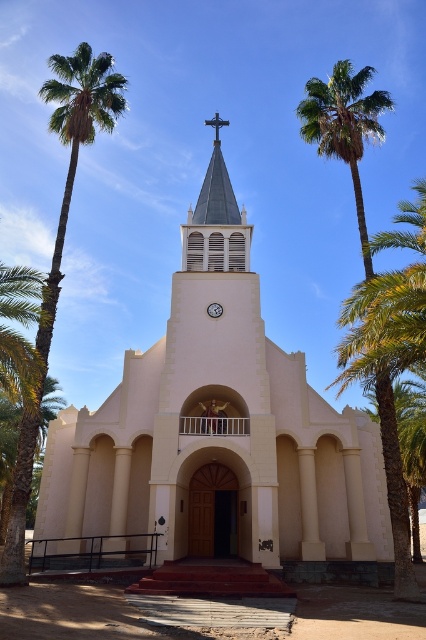
You are standing in front of the church and want to take a photo that includes both the white smooth church at center and the green leafy palm tree at left. Which object should you frame first in your camera to ensure both fit in the shot?

Since the white smooth church at center is smaller than the green leafy palm tree at left, you should frame the white smooth church at center first as it requires less space in the camera frame to accommodate the larger palm tree.